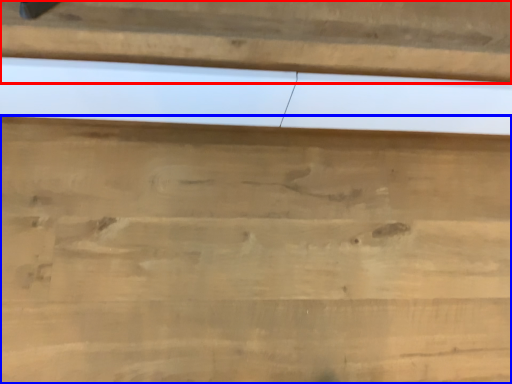
Question: Among these objects, which one is nearest to the camera, panel (highlighted by a red box) or cutting board (highlighted by a blue box)?

Choices:
 (A) panel
 (B) cutting board

Answer: (A)